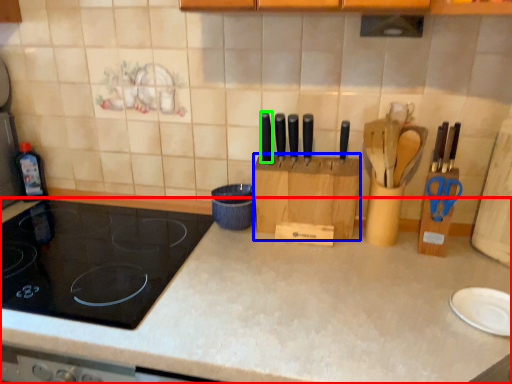
Question: Which object is positioned farthest from countertop (highlighted by a red box)? Select from cardboard box (highlighted by a blue box) and knife (highlighted by a green box).

Choices:
 (A) cardboard box
 (B) knife

Answer: (B)